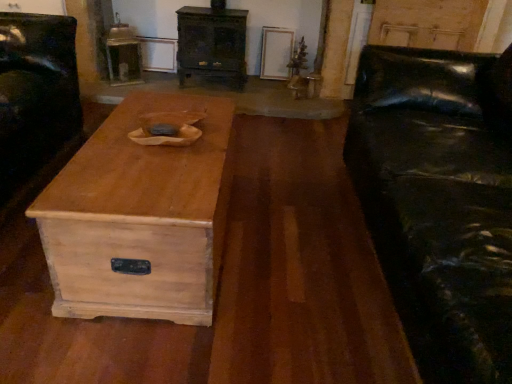
Describe the element at coordinates (438, 203) in the screenshot. This screenshot has width=512, height=384. I see `black leather couch at right` at that location.

The height and width of the screenshot is (384, 512). Find the location of `black leather couch at right`. black leather couch at right is located at coordinates (438, 203).

The height and width of the screenshot is (384, 512). I want to click on black leather couch at right, so click(438, 203).

From a real-world perspective, is wooden chest of drawers at center positioned over black leather couch at right based on gravity?

No, from a real-world perspective, wooden chest of drawers at center is not over black leather couch at right

Is wooden chest of drawers at center facing towards black leather couch at right?

No, wooden chest of drawers at center is not oriented towards black leather couch at right.

Is wooden chest of drawers at center taller than black leather couch at right?

Incorrect, the height of wooden chest of drawers at center is not larger of that of black leather couch at right.

Is wooden chest of drawers at center not within black leather couch at right?

That's correct, wooden chest of drawers at center is outside of black leather couch at right.

From a real-world perspective, is black leather couch at right below black leather armchair at left?

No, from a real-world perspective, black leather couch at right is not under black leather armchair at left.

Is black leather couch at right shorter than black leather armchair at left?

No.

Is point (436, 281) behind point (11, 13)?

No, it is not.

Is black leather couch at right wider than black leather armchair at left?

Yes.

Between black leather armchair at left and wooden chest of drawers at center, which one has less height?

With less height is wooden chest of drawers at center.

Is black leather armchair at left facing away from wooden chest of drawers at center?

That's not correct — black leather armchair at left is not looking away from wooden chest of drawers at center.

Between black leather armchair at left and wooden chest of drawers at center, which one is positioned behind?

wooden chest of drawers at center is further away from the camera.

Is black leather armchair at left bigger or smaller than wooden chest of drawers at center?

Clearly, black leather armchair at left is larger in size than wooden chest of drawers at center.

How different are the orientations of light brown wood coffee table at center and black leather couch at right in degrees?

The facing directions of light brown wood coffee table at center and black leather couch at right are 0.000634 degrees apart.

Is black leather couch at right a part of light brown wood coffee table at center?

Definitely not — black leather couch at right is not inside light brown wood coffee table at center.

Does light brown wood coffee table at center have a larger size compared to black leather couch at right?

No, light brown wood coffee table at center is not bigger than black leather couch at right.

The height and width of the screenshot is (384, 512). I want to click on studio couch above the light brown wood coffee table at center (from a real-world perspective), so click(438, 203).

Considering the sizes of black leather couch at right and light brown wood coffee table at center in the image, is black leather couch at right wider or thinner than light brown wood coffee table at center?

Considering their sizes, black leather couch at right looks broader than light brown wood coffee table at center.

Is black leather couch at right with light brown wood coffee table at center?

They are not placed beside each other.

Does black leather couch at right turn towards light brown wood coffee table at center?

Yes, black leather couch at right is turned towards light brown wood coffee table at center.

Can you tell me how much wooden chest of drawers at center and light brown wood coffee table at center differ in facing direction?

The angular difference between wooden chest of drawers at center and light brown wood coffee table at center is 91.7 degrees.

From a real-world perspective, is wooden chest of drawers at center located beneath light brown wood coffee table at center?

No, from a real-world perspective, wooden chest of drawers at center is not beneath light brown wood coffee table at center.

Looking at this image, does wooden chest of drawers at center touch light brown wood coffee table at center?

No.

Is wooden chest of drawers at center turned away from light brown wood coffee table at center?

wooden chest of drawers at center does not have its back to light brown wood coffee table at center.

Is light brown wood coffee table at center wider than black leather armchair at left?

In fact, light brown wood coffee table at center might be narrower than black leather armchair at left.

Is light brown wood coffee table at center next to black leather armchair at left and touching it?

light brown wood coffee table at center is not next to black leather armchair at left, and they're not touching.

This screenshot has width=512, height=384. Find the location of `armchair that appears above the light brown wood coffee table at center (from the image's perspective)`. armchair that appears above the light brown wood coffee table at center (from the image's perspective) is located at coordinates (36, 92).

The height and width of the screenshot is (384, 512). I want to click on chest of drawers above the black leather couch at right (from the image's perspective), so click(x=212, y=43).

Identify the location of armchair that is behind the black leather couch at right. This screenshot has height=384, width=512. (36, 92).

Looking at the image, which one is located further to black leather couch at right, wooden chest of drawers at center or black leather armchair at left?

wooden chest of drawers at center is positioned further to the anchor black leather couch at right.

When comparing their distances from light brown wood coffee table at center, does black leather armchair at left or black leather couch at right seem further?

Based on the image, black leather couch at right appears to be further to light brown wood coffee table at center.

Estimate the real-world distances between objects in this image. Which object is closer to wooden chest of drawers at center, light brown wood coffee table at center or black leather armchair at left?

black leather armchair at left lies closer to wooden chest of drawers at center than the other object.

Based on the photo, based on their spatial positions, is light brown wood coffee table at center or black leather couch at right further from black leather armchair at left?

black leather couch at right.

When comparing their distances from black leather armchair at left, does black leather couch at right or wooden chest of drawers at center seem closer?

wooden chest of drawers at center lies closer to black leather armchair at left than the other object.

When comparing their distances from wooden chest of drawers at center, does black leather couch at right or black leather armchair at left seem closer?

black leather armchair at left is closer to wooden chest of drawers at center.

Consider the image. Which object lies nearer to the anchor point black leather armchair at left, light brown wood coffee table at center or wooden chest of drawers at center?

light brown wood coffee table at center.

Based on their spatial positions, is black leather armchair at left or light brown wood coffee table at center further from wooden chest of drawers at center?

light brown wood coffee table at center is positioned further to the anchor wooden chest of drawers at center.

Locate an element on the screen. The image size is (512, 384). coffee table between black leather armchair at left and black leather couch at right is located at coordinates (139, 218).

This screenshot has width=512, height=384. What are the coordinates of `armchair between black leather couch at right and wooden chest of drawers at center along the z-axis` in the screenshot? It's located at (36, 92).

Identify the location of coffee table located between black leather couch at right and wooden chest of drawers at center in the depth direction. (139, 218).

The width and height of the screenshot is (512, 384). In order to click on armchair between light brown wood coffee table at center and wooden chest of drawers at center in the front-back direction in this screenshot , I will do `click(36, 92)`.